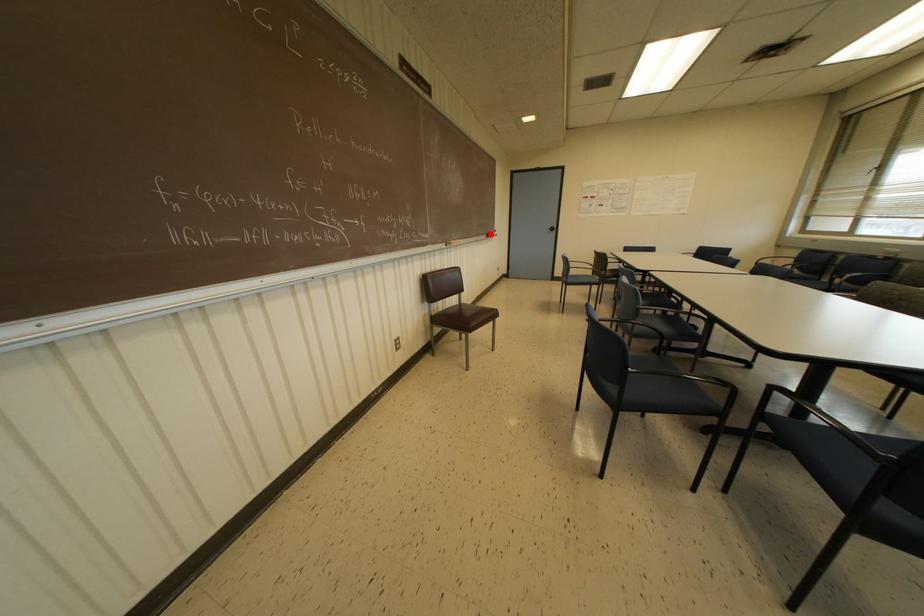
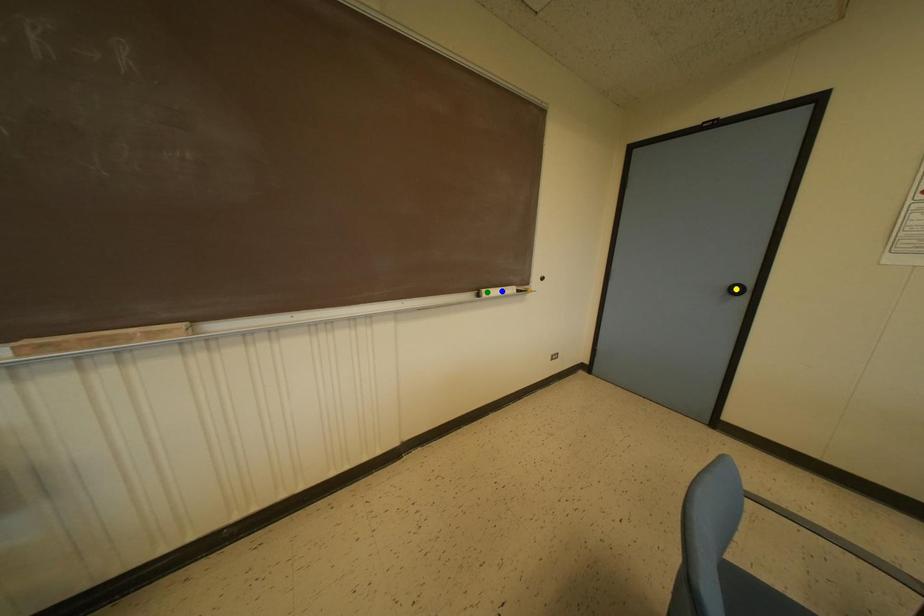
Question: I am providing you with two images of the same scene from different viewpoints. A red point is marked on the first image. You are given multiple points on the second image. Which point in image 2 is actually the same real-world point as the red point in image 1?

Choices:
 (A) yellow point
 (B) green point
 (C) blue point

Answer: (B)